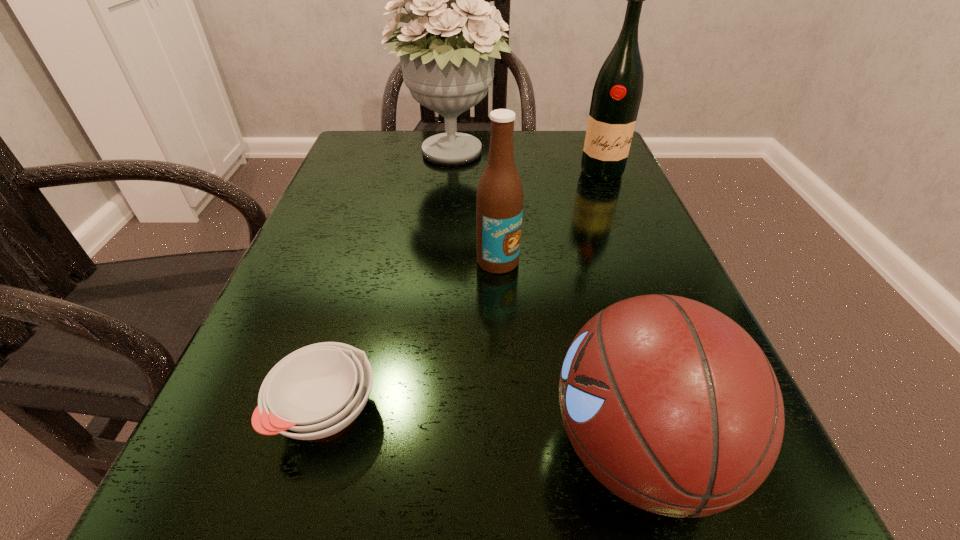
Locate an element on the screen. This screenshot has height=540, width=960. bouquet is located at coordinates (448, 70).

This screenshot has width=960, height=540. Find the location of `liquor`. liquor is located at coordinates (617, 93).

Identify the location of the third nearest object. The height and width of the screenshot is (540, 960). (499, 203).

You are a GUI agent. You are given a task and a screenshot of the screen. Output one action in this format:
    pyautogui.click(x=<x>, y=<y>)
    Task: Click on the beer bottle
    Image resolution: width=960 pixels, height=540 pixels.
    Given the screenshot: What is the action you would take?
    coord(499,203)

Locate an element on the screen. The height and width of the screenshot is (540, 960). soup bowl is located at coordinates (316, 391).

You are a GUI agent. You are given a task and a screenshot of the screen. Output one action in this format:
    pyautogui.click(x=<x>, y=<y>)
    Task: Click on the free spot located on the left of the bouquet
    Image resolution: width=960 pixels, height=540 pixels.
    Given the screenshot: What is the action you would take?
    pyautogui.click(x=342, y=154)

Where is `vacant space located 0.140m on the front-facing side of the liquor`? The width and height of the screenshot is (960, 540). vacant space located 0.140m on the front-facing side of the liquor is located at coordinates (622, 220).

The image size is (960, 540). What are the coordinates of `vacant region located on the back of the third shortest object` in the screenshot? It's located at (495, 204).

At what (x,y) coordinates should I click in order to perform the action: click on vacant region located 0.100m on the right of the shortest object. Please return your answer as a coordinate pair (x, y). Looking at the image, I should click on (461, 411).

Find the location of a particular element. bouquet present at the far edge is located at coordinates (448, 70).